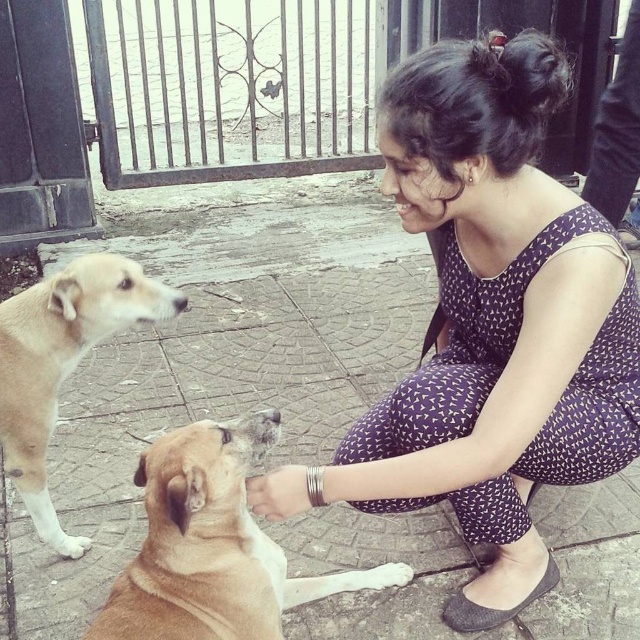
You are a photographer standing 1.5 meters away from the purple printed dress at center. Can you reach the dress to adjust its position without moving closer?

The distance between you and the purple printed dress at center is 1.30 meters, which is less than your current distance of 1.5 meters. Therefore, you cannot reach the dress without moving closer.